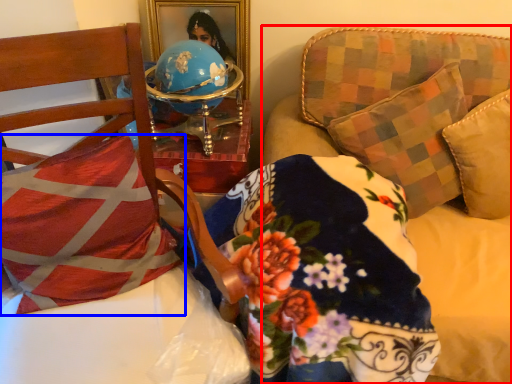
Question: Which of the following is the closest to the observer, studio couch (highlighted by a red box) or pillow (highlighted by a blue box)?

Choices:
 (A) studio couch
 (B) pillow

Answer: (A)